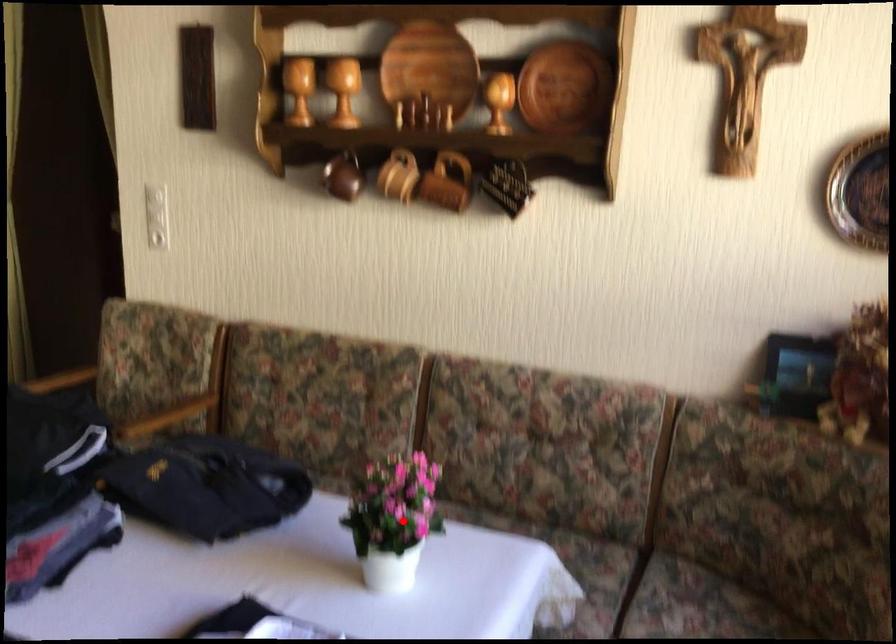
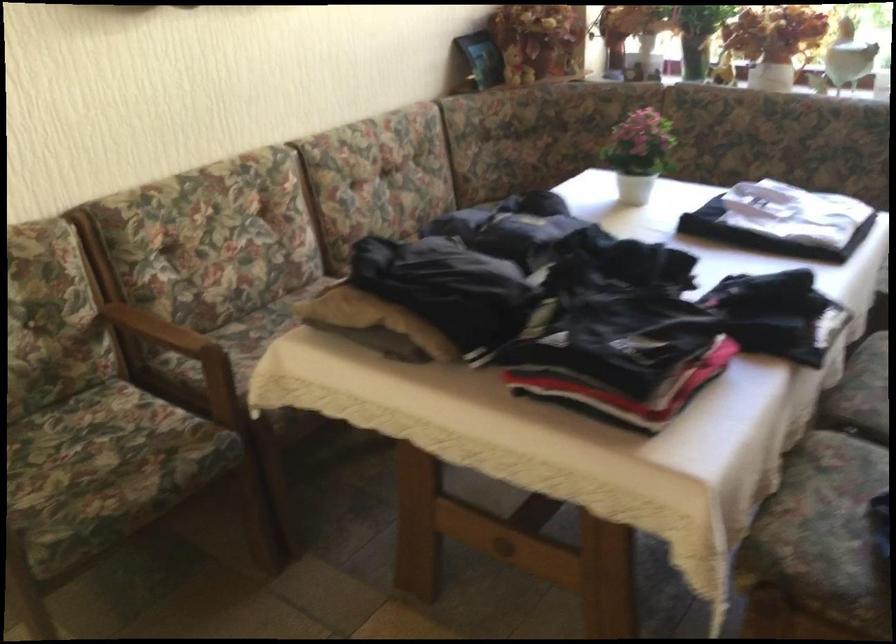
The point at the highlighted location is marked in the first image. Where is the corresponding point in the second image?

(639, 153)